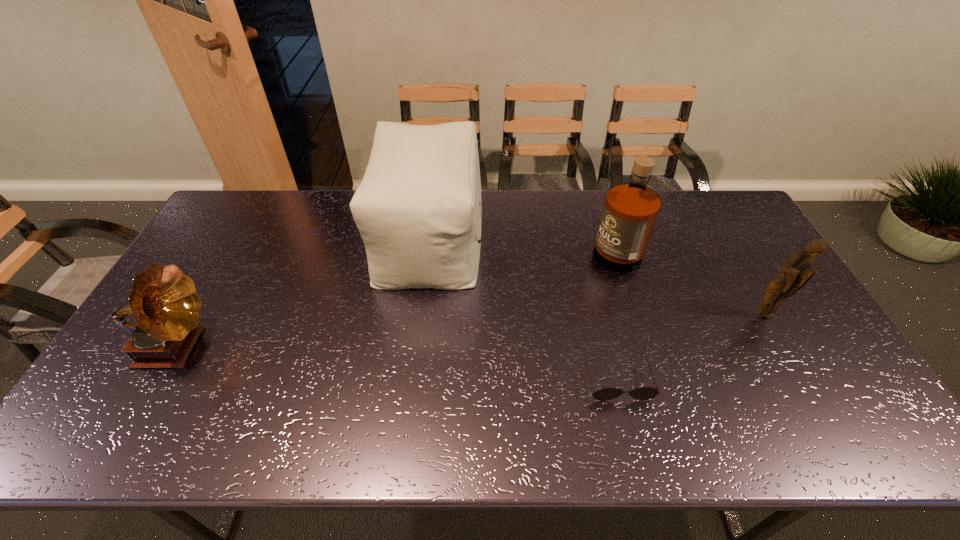
Identify the location of vacant space at the far left corner. This screenshot has height=540, width=960. (231, 213).

Locate an element on the screen. vacant space at the near right corner of the desktop is located at coordinates (862, 424).

In order to click on free spot between the shortest object and the liquor in this screenshot , I will do `click(615, 312)`.

Where is `free spot between the sunglasses and the figurine`? free spot between the sunglasses and the figurine is located at coordinates (690, 347).

Find the location of `vacant area between the rightmost object and the cushion`. vacant area between the rightmost object and the cushion is located at coordinates (596, 277).

Identify the location of free spot between the figurine and the liquor. (688, 279).

This screenshot has width=960, height=540. I want to click on free space that is in between the cushion and the liquor, so click(x=521, y=241).

Identify the location of free spot between the shortest object and the liquor. (615, 312).

Locate an element on the screen. empty space that is in between the figurine and the liquor is located at coordinates (688, 279).

Where is `free spot between the liquor and the figurine`? free spot between the liquor and the figurine is located at coordinates (688, 279).